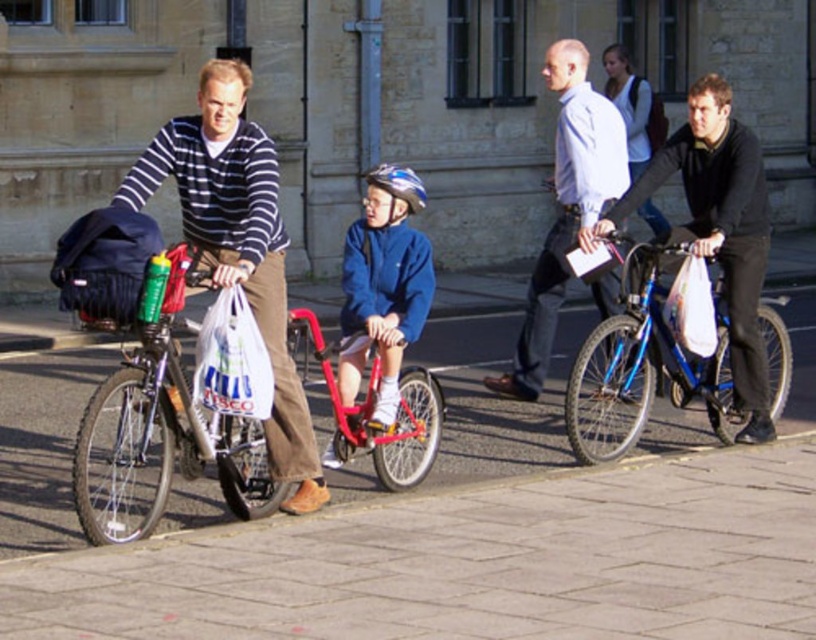
Can you confirm if striped sweater at left is positioned below blue metallic bicycle at right?

No, striped sweater at left is not below blue metallic bicycle at right.

Image resolution: width=816 pixels, height=640 pixels. Describe the element at coordinates (237, 244) in the screenshot. I see `striped sweater at left` at that location.

The height and width of the screenshot is (640, 816). Describe the element at coordinates (237, 244) in the screenshot. I see `striped sweater at left` at that location.

Where is `striped sweater at left`? striped sweater at left is located at coordinates (237, 244).

Is brick pavement at lower center wider than white plastic bag at center?

Correct, the width of brick pavement at lower center exceeds that of white plastic bag at center.

Who is more forward, [495,403] or [247,340]?

Point [247,340] is more forward.

Find the location of a particular element. This screenshot has width=816, height=640. brick pavement at lower center is located at coordinates (495, 400).

Between shiny metallic bicycle at left and blue fleece jacket at center, which one appears on the left side from the viewer's perspective?

From the viewer's perspective, shiny metallic bicycle at left appears more on the left side.

What do you see at coordinates (158, 444) in the screenshot? I see `shiny metallic bicycle at left` at bounding box center [158, 444].

Locate an element on the screen. shiny metallic bicycle at left is located at coordinates point(158,444).